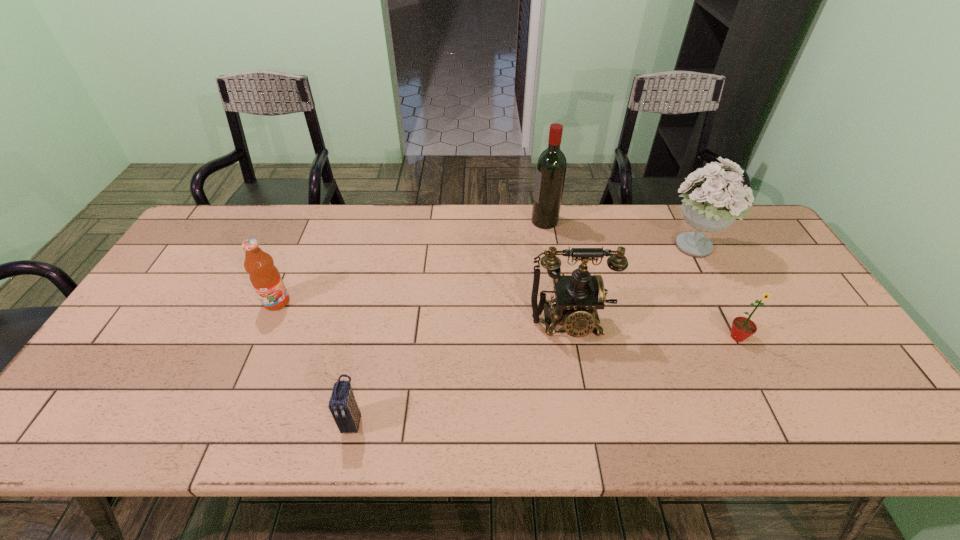
The width and height of the screenshot is (960, 540). I want to click on wine bottle, so click(551, 166).

Where is `bouquet`? The image size is (960, 540). bouquet is located at coordinates (710, 204).

I want to click on telephone, so click(x=578, y=296).

Where is `the third shortest object`? The width and height of the screenshot is (960, 540). the third shortest object is located at coordinates (264, 275).

At what (x,y) coordinates should I click in order to perform the action: click on the leftmost object. Please return your answer as a coordinate pair (x, y). This screenshot has height=540, width=960. Looking at the image, I should click on (264, 275).

Where is `the second shortest object`? Image resolution: width=960 pixels, height=540 pixels. the second shortest object is located at coordinates pos(742,328).

This screenshot has height=540, width=960. What are the coordinates of `the shortest object` in the screenshot? It's located at (343, 406).

What are the coordinates of `the fifth object from right to left` in the screenshot? It's located at (343, 406).

Identify the location of free space located 0.220m on the label of the wine bottle. (467, 221).

Locate an element on the screen. This screenshot has width=960, height=540. free location located on the label of the wine bottle is located at coordinates (434, 221).